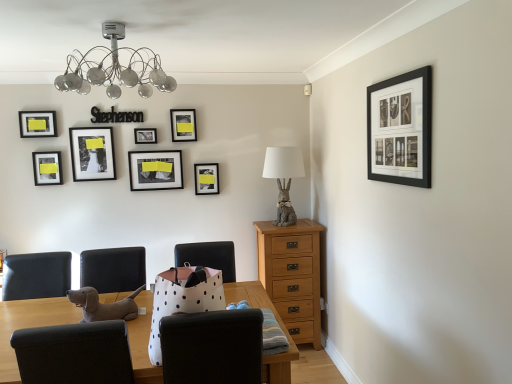
Question: In the image, is black matte picture frame at upper center, acting as the fifth picture frame starting from the right, positioned in front of or behind black matte picture frame at upper right, which is counted as the 8th picture frame, starting from the left?

Choices:
 (A) behind
 (B) front

Answer: (A)

Question: Looking at the image, does black matte picture frame at upper center, which ranks as the fourth picture frame in back-to-front order, seem bigger or smaller compared to black matte picture frame at upper right, which is counted as the 8th picture frame, starting from the left?

Choices:
 (A) small
 (B) big

Answer: (A)

Question: Which is farther from the metallic glass chandelier at upper center?

Choices:
 (A) matte gray rabbit at center right
 (B) white polka dot paper bag at center, positioned as the 2th chair in left-to-right order
 (C) matte black picture frame at left, marked as the 3th picture frame in a front-to-back arrangement
 (D) black matte picture frame at upper right, the first picture frame from the right
 (E) fuzzy fabric dog at lower left

Answer: (B)

Question: Based on their relative distances, which object is farther from the matte black picture frame at upper center, which is counted as the sixth picture frame, starting from the left?

Choices:
 (A) matte black picture frame at upper center, arranged as the sixth picture frame when viewed from the front
 (B) matte black picture frame at center, the 7th picture frame when ordered from left to right
 (C) matte black picture frame at upper left, acting as the first picture frame starting from the left
 (D) white polka dot paper bag at center, positioned as the 2th chair in left-to-right order
 (E) black matte picture frame at upper center, marked as the 4th picture frame in a left-to-right arrangement

Answer: (D)